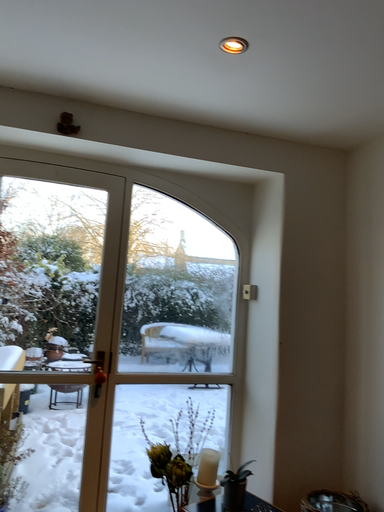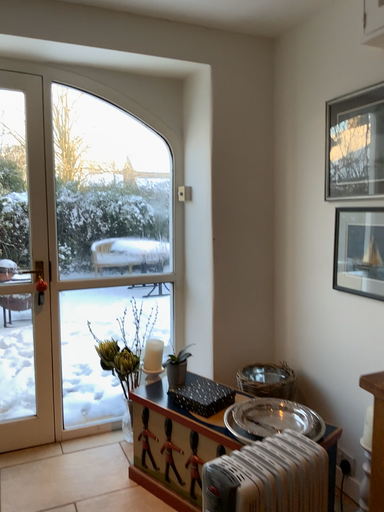
Question: How did the camera likely rotate when shooting the video?

Choices:
 (A) rotated right
 (B) rotated left

Answer: (A)